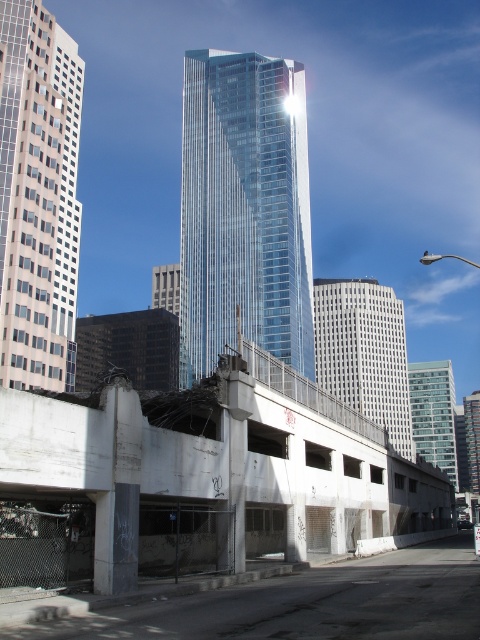
Can you confirm if concrete parking garage at center is positioned below glassy steel skyscraper at upper center?

Yes.

Does point (243, 365) come closer to viewer compared to point (0, 349)?

Yes, point (243, 365) is closer to viewer.

Between point (307, 465) and point (10, 337), which one is positioned in front?

Point (307, 465) is more forward.

Locate an element on the screen. This screenshot has width=480, height=640. concrete parking garage at center is located at coordinates (204, 477).

Can you confirm if glassy steel skyscraper at upper center is positioned to the right of glassy reflective skyscraper at center?

No, glassy steel skyscraper at upper center is not to the right of glassy reflective skyscraper at center.

Between glassy steel skyscraper at upper center and glassy reflective skyscraper at center, which one has less height?

Standing shorter between the two is glassy reflective skyscraper at center.

Which is behind, point (56, 349) or point (420, 432)?

The point (420, 432) is more distant.

The height and width of the screenshot is (640, 480). Identify the location of glassy steel skyscraper at upper center. (37, 196).

Does point (191, 552) come in front of point (349, 280)?

That is True.

Which is more to the left, concrete parking garage at center or white glass skyscraper at center?

concrete parking garage at center is more to the left.

Is point (362, 440) farther from viewer compared to point (368, 364)?

No, (362, 440) is in front of (368, 364).

The image size is (480, 640). I want to click on concrete parking garage at center, so click(204, 477).